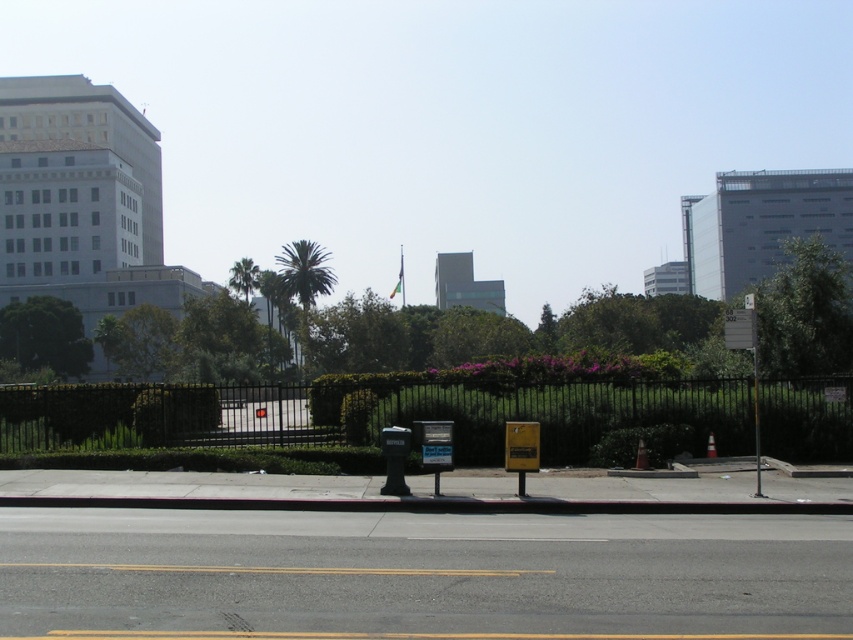
You are a city planner assessing the urban space. You need to determine if the green leafy tree at upper right can be safely pruned to allow more sunlight to reach the black plastic parking meter at center. Based on their sizes, is this feasible?

The green leafy tree at upper right is larger than the black plastic parking meter at center, so pruning the tree to allow more sunlight to reach the parking meter is feasible as the tree has sufficient size to accommodate pruning without compromising its health.

You are a city planner reviewing this urban scene. You need to determine if the black plastic parking meter at center is positioned in a way that it does not block the view of the green leafy palm at center from the sidewalk. Based on the image, can you confirm this?

The black plastic parking meter at center is located below the green leafy palm at center, so it does not block the view of the palm from the sidewalk.

Based on the photo, you are standing at the point marked as point [138,340] in the image. Based on the scene description, what is the closest object to you?

The closest object to you is the green leafy tree at center because the point [138,340] is on it.